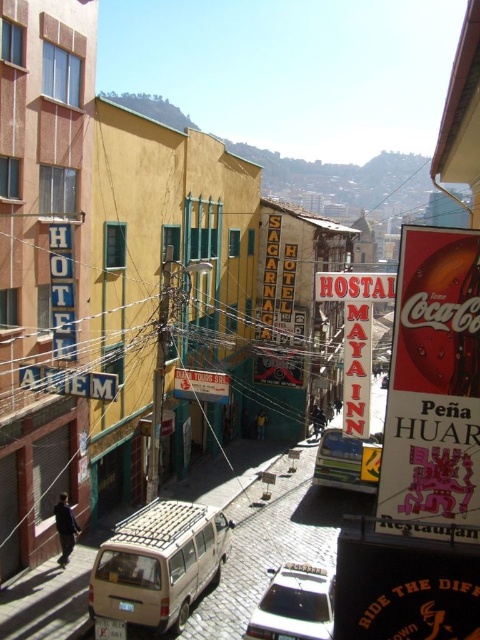
Is white glossy car at center closer to the viewer compared to metallic silver van at center?

Yes, it is.

The width and height of the screenshot is (480, 640). What do you see at coordinates (295, 604) in the screenshot?
I see `white glossy car at center` at bounding box center [295, 604].

The width and height of the screenshot is (480, 640). Identify the location of white glossy car at center. (295, 604).

Is beige matte van at lower center wider than metallic silver van at center?

No, beige matte van at lower center is not wider than metallic silver van at center.

Who is more distant from viewer, [166,536] or [371,468]?

Point [371,468]

Image resolution: width=480 pixels, height=640 pixels. What do you see at coordinates (157, 564) in the screenshot? I see `beige matte van at lower center` at bounding box center [157, 564].

Where is `beige matte van at lower center`? Image resolution: width=480 pixels, height=640 pixels. beige matte van at lower center is located at coordinates (157, 564).

Is point (402, 378) behind point (319, 579)?

No, it is in front of (319, 579).

Between red cardboard coca-cola sign at right and white glossy car at center, which one appears on the right side from the viewer's perspective?

red cardboard coca-cola sign at right

You are a GUI agent. You are given a task and a screenshot of the screen. Output one action in this format:
    pyautogui.click(x=<x>, y=<y>)
    Task: Click on the red cardboard coca-cola sign at right
    This screenshot has height=640, width=480.
    Given the screenshot: What is the action you would take?
    pyautogui.click(x=433, y=388)

Image resolution: width=480 pixels, height=640 pixels. I want to click on red cardboard coca-cola sign at right, so click(x=433, y=388).